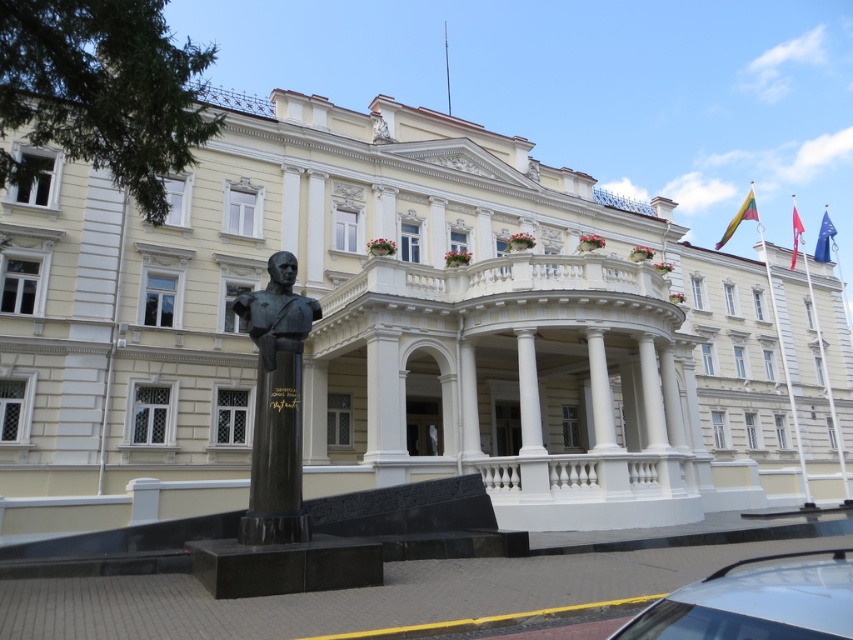
You are standing at the entrance of the grand neoclassical building and want to place a new decorative statue exactly at the same position as the black polished stone bust at center. What are the coordinates where you should place the new statue?

The coordinates for the black polished stone bust at center are at point (276, 404), so you should place the new statue at those coordinates.

You are standing in front of the grand neoclassical building and want to park your white glossy car at lower right. What are the coordinates where you can park it?

The white glossy car at lower right can be parked at coordinates point (756, 602).

Consider the image. You are an event organizer planning to place a 1.2 meter wide decorative archway in front of the building. The archway must be positioned between the black polished stone bust at center and the red fabric flag at upper right. Based on the scene description, can the archway fit between them without overlapping either object?

Answer: The black polished stone bust at center has a width less than the red fabric flag at upper right. However, the exact distance between them isn not provided. Therefore, it is uncertain if the 1.2 meter wide archway can fit between them without overlapping.